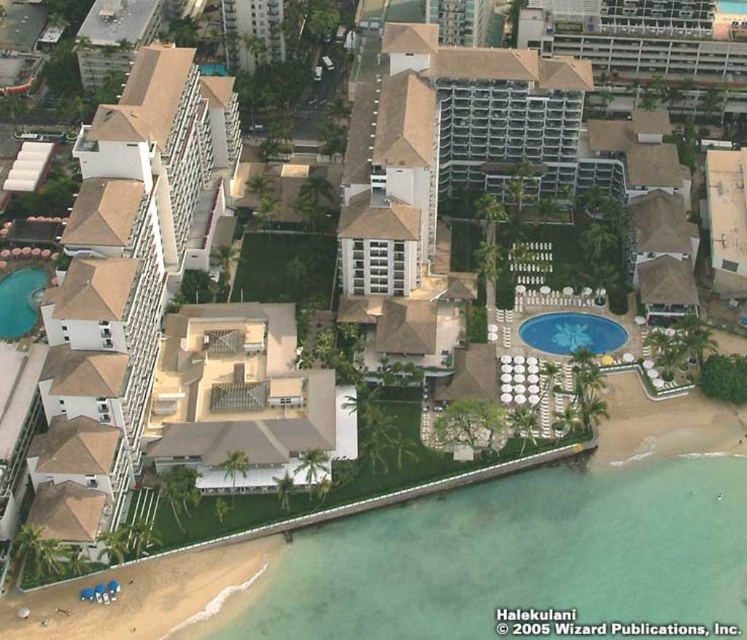
Does blue glossy pool at center right have a greater width compared to teal glossy pool at bottom left?

Correct, the width of blue glossy pool at center right exceeds that of teal glossy pool at bottom left.

In the scene shown: Does blue glossy pool at center right have a larger size compared to teal glossy pool at bottom left?

Actually, blue glossy pool at center right might be smaller than teal glossy pool at bottom left.

The image size is (747, 640). I want to click on blue glossy pool at center right, so click(x=571, y=332).

Find the location of a particular element. This screenshot has width=747, height=640. blue glossy pool at center right is located at coordinates (571, 332).